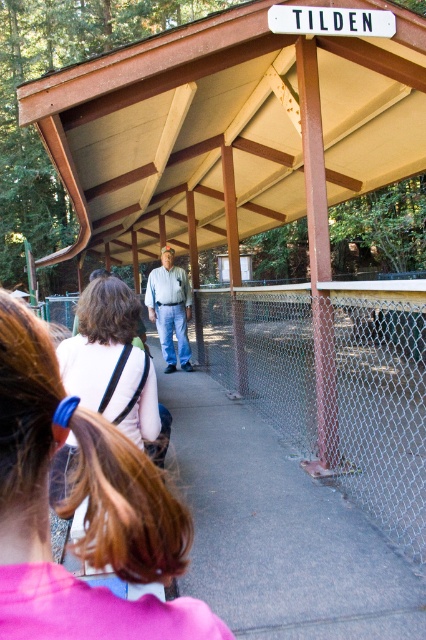
Is point (161, 554) closer to camera compared to point (181, 289)?

Yes, it is.

Looking at this image, is light brown hair at center thinner than light blue jeans at center?

Yes, light brown hair at center is thinner than light blue jeans at center.

Does point (121, 472) come closer to viewer compared to point (181, 296)?

Yes.

Where is `light brown hair at center`? This screenshot has height=640, width=426. light brown hair at center is located at coordinates (86, 512).

Between metal chain-link fence at center and light brown hair at center, which one appears on the left side from the viewer's perspective?

Positioned to the left is light brown hair at center.

Does point (238, 333) come in front of point (95, 541)?

That is False.

Locate an element on the screen. The height and width of the screenshot is (640, 426). metal chain-link fence at center is located at coordinates (333, 384).

Can you confirm if wooden roof at center is taller than light brown hair at center?

Yes.

Which is in front, point (362, 113) or point (40, 392)?

Point (40, 392)

Identify the location of wooden roof at center. The width and height of the screenshot is (426, 640). (230, 129).